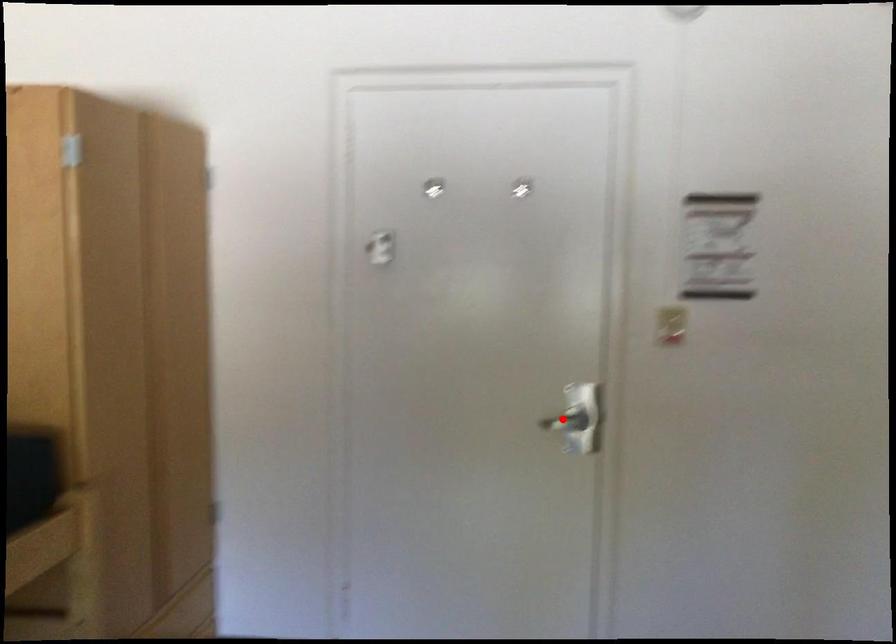
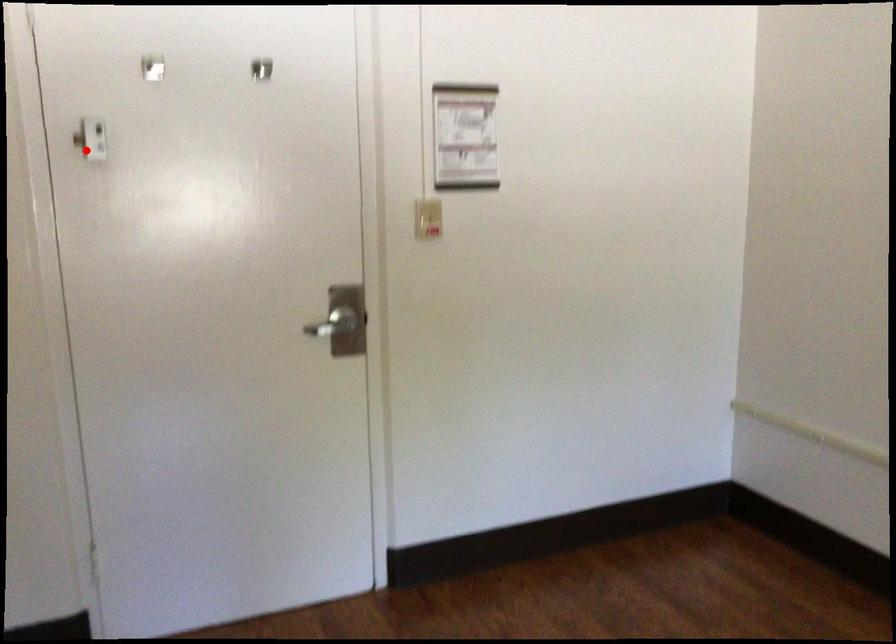
I am providing you with two images of the same scene from different viewpoints. A red point is marked on the first image and another point is marked on the second image. Does the point marked in image1 correspond to the same location as the one in image2?

No